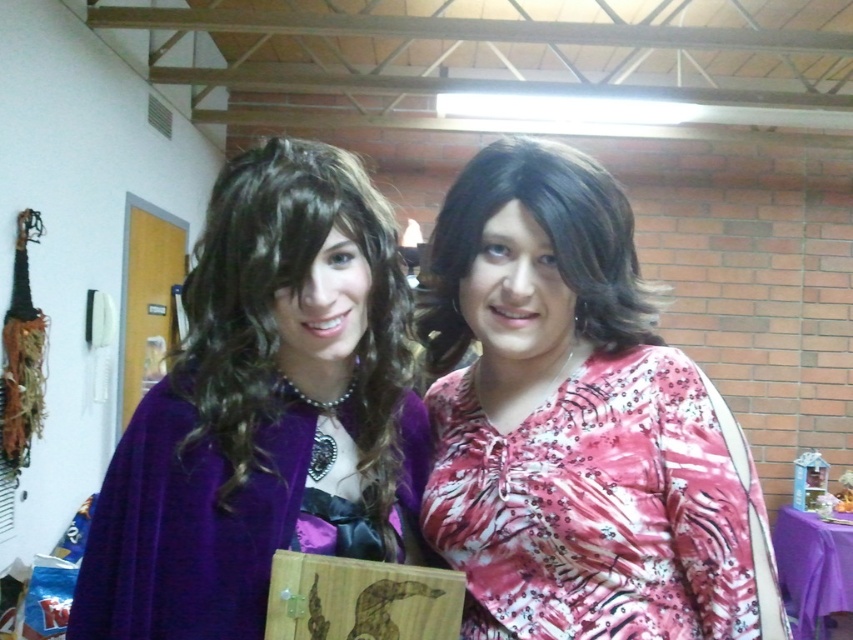
Question: Which of the following is the closest to the observer?

Choices:
 (A) (126, 568)
 (B) (489, 188)
 (C) (474, 504)

Answer: (A)

Question: Can you confirm if pink sequined blouse at center is positioned below velvet purple cape at left?

Choices:
 (A) no
 (B) yes

Answer: (A)

Question: Is the position of pink sequined blouse at center more distant than that of shiny brown wig at center?

Choices:
 (A) no
 (B) yes

Answer: (A)

Question: Which is nearer to the velvet purple cape at left?

Choices:
 (A) pink sequined blouse at center
 (B) shiny brown wig at center

Answer: (A)

Question: In this image, where is pink sequined blouse at center located relative to shiny brown wig at center?

Choices:
 (A) below
 (B) above

Answer: (A)

Question: Which object appears farthest from the camera in this image?

Choices:
 (A) velvet purple cape at left
 (B) pink sequined blouse at center

Answer: (B)